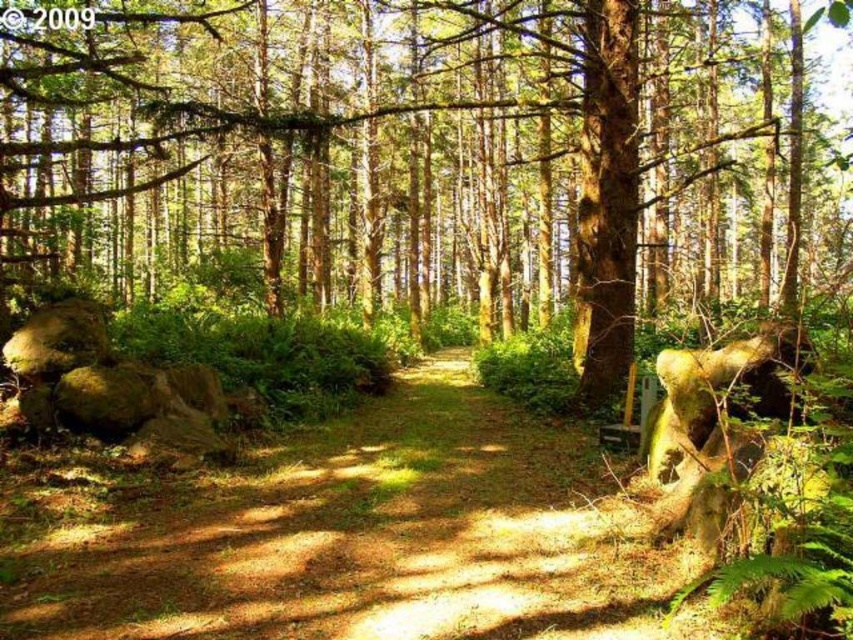
Between point (560, 92) and point (497, 554), which one is positioned behind?

The point (560, 92) is behind.

Based on the photo, is green mossy tree at center in front of brown dirt path at center?

Yes, green mossy tree at center is closer to the viewer.

Looking at this image, who is more forward, (143, 106) or (120, 632)?

Point (120, 632) is in front.

You are a GUI agent. You are given a task and a screenshot of the screen. Output one action in this format:
    pyautogui.click(x=<x>, y=<y>)
    Task: Click on the green mossy tree at center
    This screenshot has width=853, height=640.
    Given the screenshot: What is the action you would take?
    pyautogui.click(x=431, y=160)